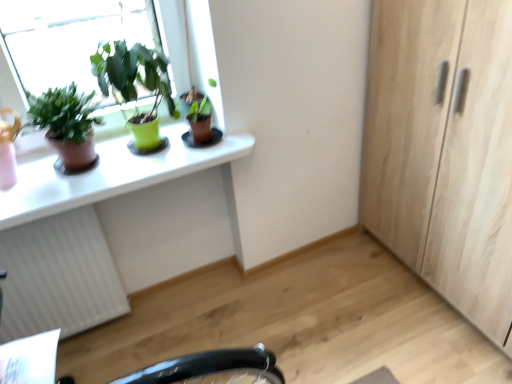
The image size is (512, 384). What do you see at coordinates (199, 118) in the screenshot? I see `matte brown pot at upper center, which ranks as the 1th houseplant in right-to-left order` at bounding box center [199, 118].

Describe the element at coordinates (134, 84) in the screenshot. I see `green matte pot at upper left, the second houseplant positioned from the right` at that location.

What are the coordinates of `light wood cabinet at right` in the screenshot? It's located at point(444,150).

Find the location of a particular element. This screenshot has width=512, height=384. white glossy desk at upper left is located at coordinates pos(109,175).

Is light wood cabinet at right oriented towards white textured radiator at lower left?

Answer: Yes, light wood cabinet at right is aimed at white textured radiator at lower left.

How many degrees apart are the facing directions of light wood cabinet at right and white textured radiator at lower left?

The angular difference between light wood cabinet at right and white textured radiator at lower left is 91.4 degrees.

Which is behind, point (450, 142) or point (114, 313)?

The point (114, 313) is farther.

From the image's perspective, which object appears higher, light wood cabinet at right or white textured radiator at lower left?

From the image's view, light wood cabinet at right is above.

Is matte brown pot at upper left, placed as the first houseplant when sorted from left to right, shorter than light wood cabinet at right?

Yes.

Which object is further away from the camera, matte brown pot at upper left, arranged as the 3th houseplant when viewed from the right, or light wood cabinet at right?

matte brown pot at upper left, arranged as the 3th houseplant when viewed from the right, is further from the camera.

Is matte brown pot at upper left, arranged as the 3th houseplant when viewed from the right, with light wood cabinet at right?

They are not placed beside each other.

Does matte brown pot at upper left, arranged as the 3th houseplant when viewed from the right, have a lesser width compared to light wood cabinet at right?

Yes.

Considering the relative sizes of white glossy computer desk at upper left and green matte pot at upper left, the second houseplant positioned from the right, in the image provided, is white glossy computer desk at upper left thinner than green matte pot at upper left, the second houseplant positioned from the right,?

Incorrect, the width of white glossy computer desk at upper left is not less than that of green matte pot at upper left, the second houseplant positioned from the right.

From the image's perspective, is white glossy computer desk at upper left located beneath green matte pot at upper left, which is counted as the 2th houseplant, starting from the left?

Yes, from the image's perspective, white glossy computer desk at upper left is beneath green matte pot at upper left, which is counted as the 2th houseplant, starting from the left.

From a real-world perspective, which object stands above the other?

green matte pot at upper left, the second houseplant positioned from the right, is physically above.

Measure the distance between light wood cabinet at right and white glossy computer desk at upper left.

They are 1.03 meters apart.

Does point (421, 54) appear closer or farther from the camera than point (52, 295)?

Clearly, point (421, 54) is closer to the camera than point (52, 295).

Based on the photo, considering the relative sizes of light wood cabinet at right and white glossy computer desk at upper left in the image provided, is light wood cabinet at right taller than white glossy computer desk at upper left?

Yes.

From the image's perspective, which is above, light wood cabinet at right or white glossy computer desk at upper left?

light wood cabinet at right is shown above in the image.

Based on the photo, considering the relative sizes of green matte pot at upper left, the second houseplant positioned from the right, and light wood cabinet at right in the image provided, is green matte pot at upper left, the second houseplant positioned from the right, smaller than light wood cabinet at right?

Correct, green matte pot at upper left, the second houseplant positioned from the right, occupies less space than light wood cabinet at right.

Which is behind, point (162, 90) or point (386, 36)?

The point (162, 90) is more distant.

From the image's perspective, is green matte pot at upper left, the second houseplant positioned from the right, above or below light wood cabinet at right?

Based on their image positions, green matte pot at upper left, the second houseplant positioned from the right, is located above light wood cabinet at right.

Does green matte pot at upper left, which is counted as the 2th houseplant, starting from the left, lie behind light wood cabinet at right?

Yes, green matte pot at upper left, which is counted as the 2th houseplant, starting from the left, is further from the camera.

Find the location of a particular element. This screenshot has width=512, height=384. cabinetry above the white glossy desk at upper left (from the image's perspective) is located at coordinates (444, 150).

In terms of width, does light wood cabinet at right look wider or thinner when compared to white glossy desk at upper left?

light wood cabinet at right is wider than white glossy desk at upper left.

Does light wood cabinet at right turn towards white glossy desk at upper left?

Yes, light wood cabinet at right is aimed at white glossy desk at upper left.

Consider the image. Is white glossy computer desk at upper left completely or partially outside of white glossy desk at upper left?

white glossy computer desk at upper left is positioned outside white glossy desk at upper left.

Which object is thinner, white glossy computer desk at upper left or white glossy desk at upper left?

With smaller width is white glossy desk at upper left.

From a real-world perspective, is white glossy computer desk at upper left over white glossy desk at upper left?

Actually, white glossy computer desk at upper left is physically below white glossy desk at upper left in the real world.

From the image's perspective, is white glossy computer desk at upper left above or below white glossy desk at upper left?

Clearly, from the image's perspective, white glossy computer desk at upper left is below white glossy desk at upper left.

Where is `radiator behind the light wood cabinet at right`? The height and width of the screenshot is (384, 512). radiator behind the light wood cabinet at right is located at coordinates (58, 276).

Where is `cabinetry in front of the matte brown pot at upper left, arranged as the 3th houseplant when viewed from the right`? cabinetry in front of the matte brown pot at upper left, arranged as the 3th houseplant when viewed from the right is located at coordinates (444, 150).

Consider the image. Based on their spatial positions, is white glossy desk at upper left or matte brown pot at upper left, arranged as the 3th houseplant when viewed from the right, further from green matte pot at upper left, which is counted as the 2th houseplant, starting from the left?

white glossy desk at upper left is positioned further to the anchor green matte pot at upper left, which is counted as the 2th houseplant, starting from the left.

Based on their spatial positions, is matte brown pot at upper left, placed as the first houseplant when sorted from left to right, or green matte pot at upper left, the second houseplant positioned from the right, closer to white glossy desk at upper left?

matte brown pot at upper left, placed as the first houseplant when sorted from left to right.

From the image, which object appears to be farther from green matte pot at upper left, the second houseplant positioned from the right, white textured radiator at lower left or matte brown pot at upper left, arranged as the 3th houseplant when viewed from the right?

A: Among the two, white textured radiator at lower left is located further to green matte pot at upper left, the second houseplant positioned from the right.

When comparing their distances from green matte pot at upper left, the second houseplant positioned from the right, does light wood cabinet at right or white textured radiator at lower left seem further?

Based on the image, light wood cabinet at right appears to be further to green matte pot at upper left, the second houseplant positioned from the right.

From the image, which object appears to be farther from matte brown pot at upper left, placed as the first houseplant when sorted from left to right, light wood cabinet at right or white textured radiator at lower left?

The object further to matte brown pot at upper left, placed as the first houseplant when sorted from left to right, is light wood cabinet at right.

Based on the photo, based on their spatial positions, is matte brown pot at upper left, placed as the first houseplant when sorted from left to right, or matte brown pot at upper center, which ranks as the 3th houseplant in left-to-right order, closer to white glossy computer desk at upper left?

The object closer to white glossy computer desk at upper left is matte brown pot at upper left, placed as the first houseplant when sorted from left to right.

Which object lies nearer to the anchor point light wood cabinet at right, matte brown pot at upper left, arranged as the 3th houseplant when viewed from the right, or green matte pot at upper left, which is counted as the 2th houseplant, starting from the left?

green matte pot at upper left, which is counted as the 2th houseplant, starting from the left, lies closer to light wood cabinet at right than the other object.

When comparing their distances from white glossy computer desk at upper left, does white glossy desk at upper left or matte brown pot at upper center, which ranks as the 3th houseplant in left-to-right order, seem further?

Based on the image, matte brown pot at upper center, which ranks as the 3th houseplant in left-to-right order, appears to be further to white glossy computer desk at upper left.

Locate an element on the screen. houseplant between white glossy desk at upper left and matte brown pot at upper center, which ranks as the 3th houseplant in left-to-right order, in the horizontal direction is located at coordinates (134, 84).

At what (x,y) coordinates should I click in order to perform the action: click on desk between green matte pot at upper left, which is counted as the 2th houseplant, starting from the left, and white textured radiator at lower left in the up-down direction. Please return your answer as a coordinate pair (x, y). Looking at the image, I should click on (109, 175).

Where is `computer desk between white textured radiator at lower left and light wood cabinet at right from left to right`? The width and height of the screenshot is (512, 384). computer desk between white textured radiator at lower left and light wood cabinet at right from left to right is located at coordinates (80, 232).

Locate an element on the screen. This screenshot has height=384, width=512. desk positioned between white glossy computer desk at upper left and green matte pot at upper left, the second houseplant positioned from the right, from near to far is located at coordinates (109, 175).